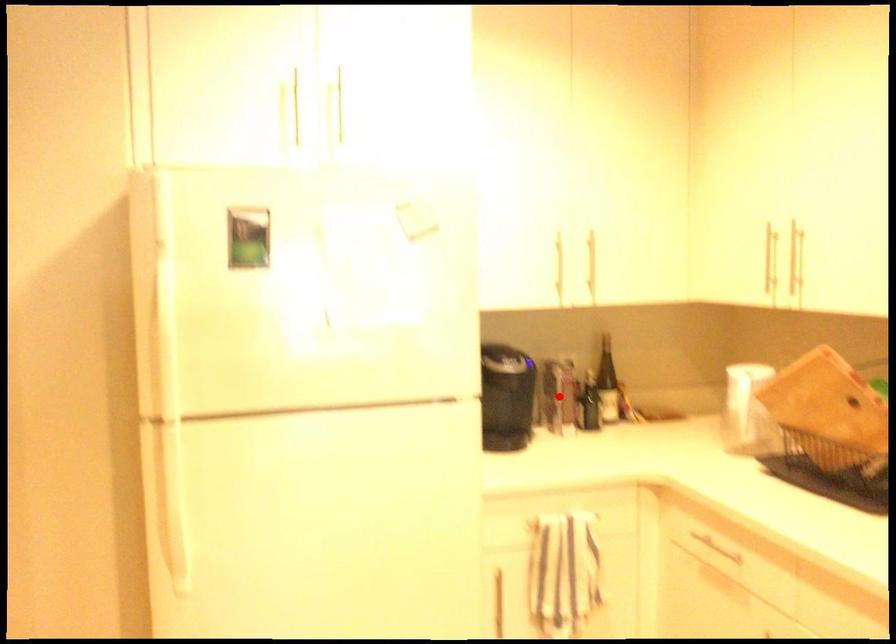
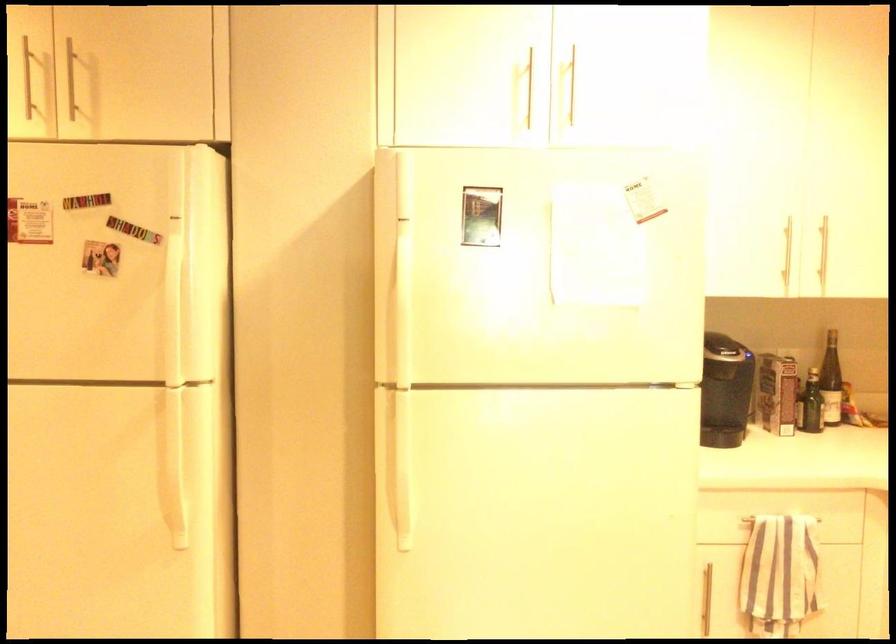
Question: I am providing you with two images of the same scene from different viewpoints. A red point is marked on the first image. Can you still see the location of the red point in image 2?

Choices:
 (A) Yes
 (B) No

Answer: (A)